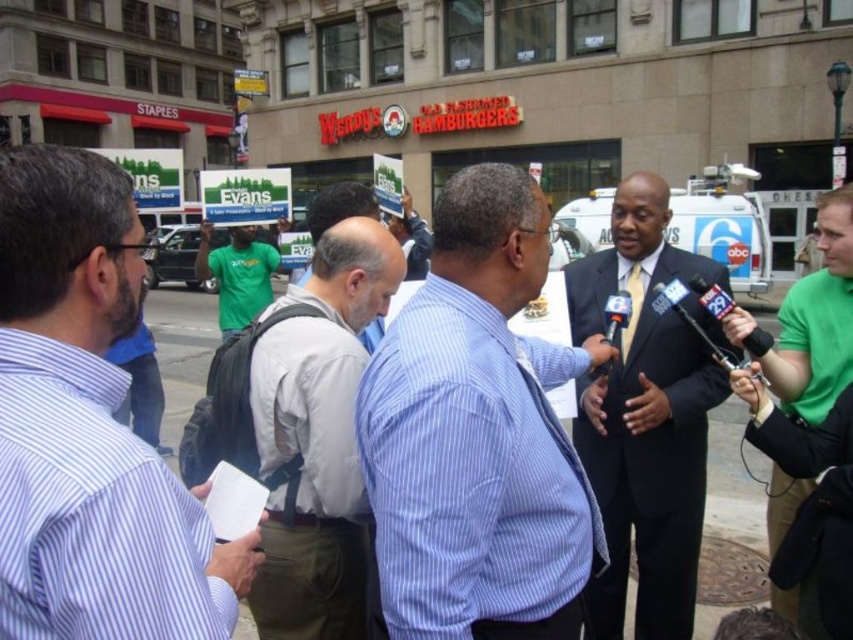
Question: Which of the following is the farthest from the observer?

Choices:
 (A) black plastic microphone at right
 (B) green fabric shirt at center

Answer: (A)

Question: Does light gray shirt at center have a smaller size compared to green t-shirt at center?

Choices:
 (A) yes
 (B) no

Answer: (B)

Question: Does striped cotton shirt at left have a smaller size compared to gray striped shirt at center?

Choices:
 (A) yes
 (B) no

Answer: (A)

Question: Which object is closer to the camera taking this photo?

Choices:
 (A) black plastic microphone at right
 (B) metallic black microphone at center
 (C) green fabric shirt at center
 (D) green t-shirt at center

Answer: (C)

Question: Which of the following is the farthest from the observer?

Choices:
 (A) black plastic microphone at right
 (B) metallic black microphone at center

Answer: (B)

Question: Considering the relative positions of blue striped shirt at center and gray striped shirt at center in the image provided, where is blue striped shirt at center located with respect to gray striped shirt at center?

Choices:
 (A) above
 (B) below

Answer: (B)